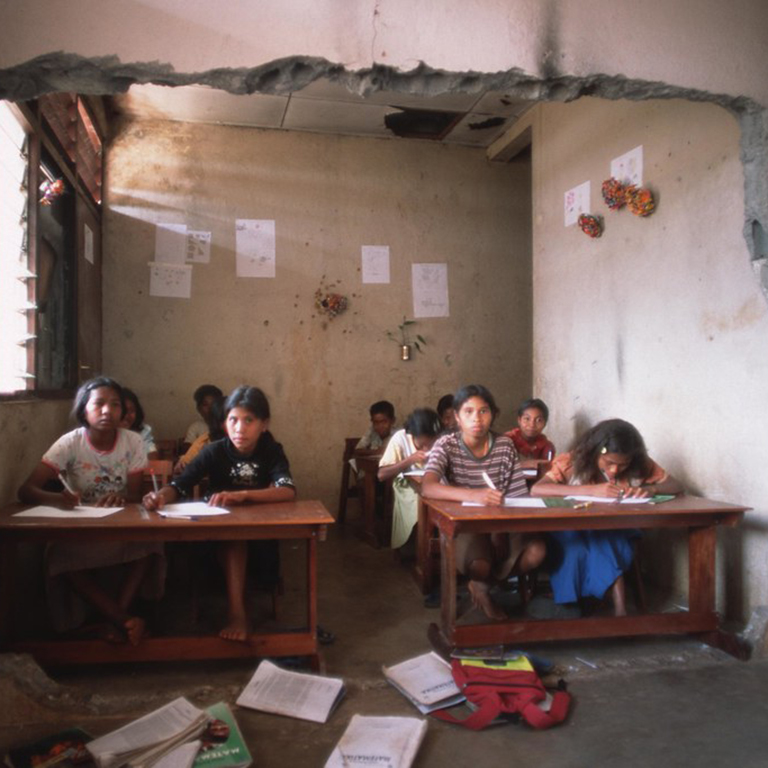
At what (x,y) coordinates should I click in order to perform the action: click on book. Please return your answer as a coordinate pair (x, y). Image resolution: width=768 pixels, height=768 pixels. Looking at the image, I should click on (214, 743).